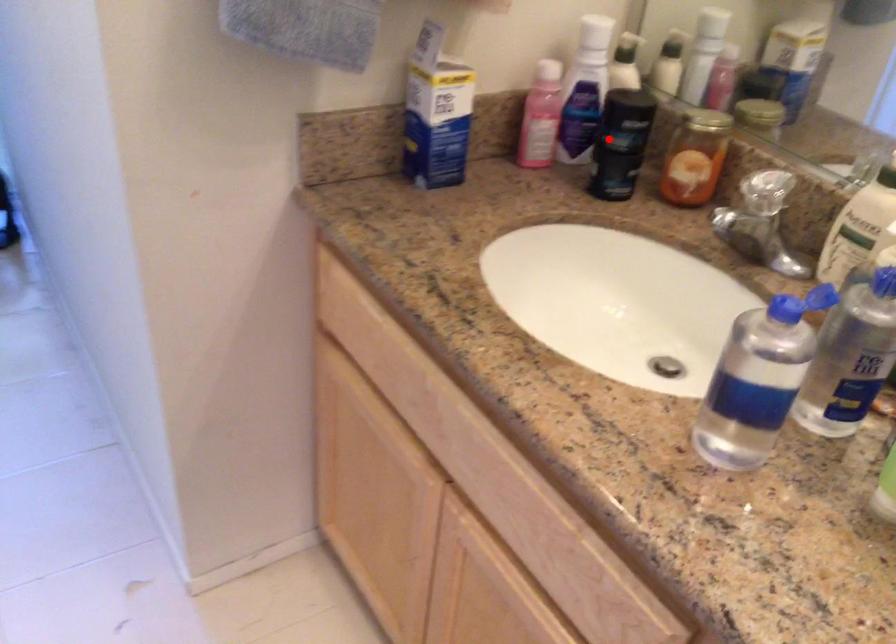
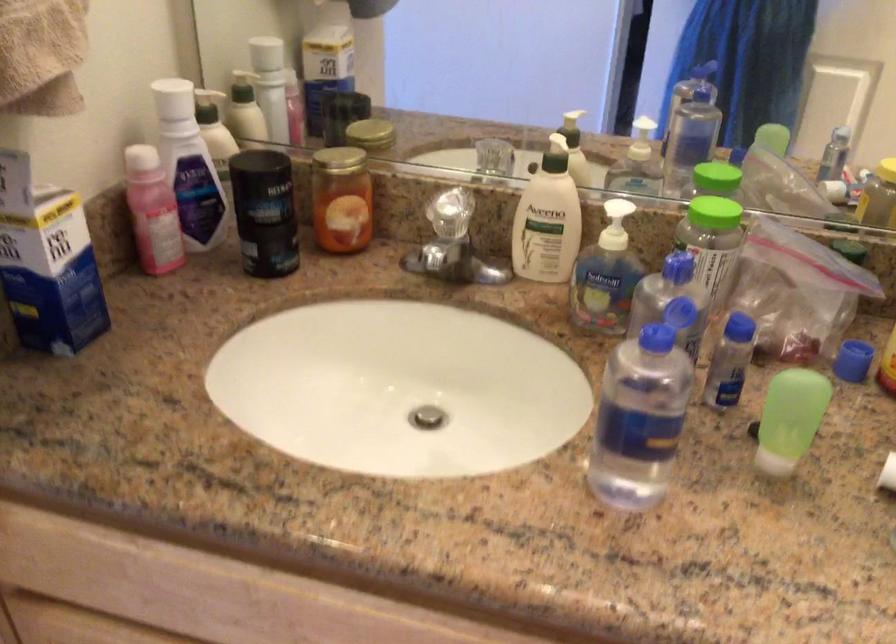
Find the pixel in the second image that matches the highlighted location in the first image.

(264, 212)